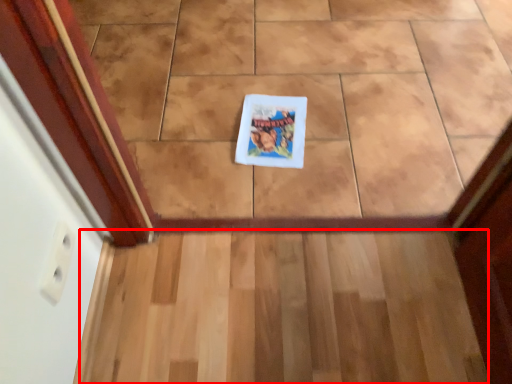
Question: Observing the image, what is the correct spatial positioning of stairs (annotated by the red box) in reference to book cover?

Choices:
 (A) left
 (B) right

Answer: (B)